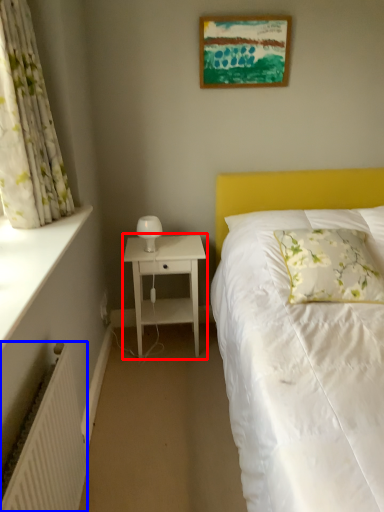
Question: Among these objects, which one is nearest to the camera, nightstand (highlighted by a red box) or radiator (highlighted by a blue box)?

Choices:
 (A) nightstand
 (B) radiator

Answer: (B)